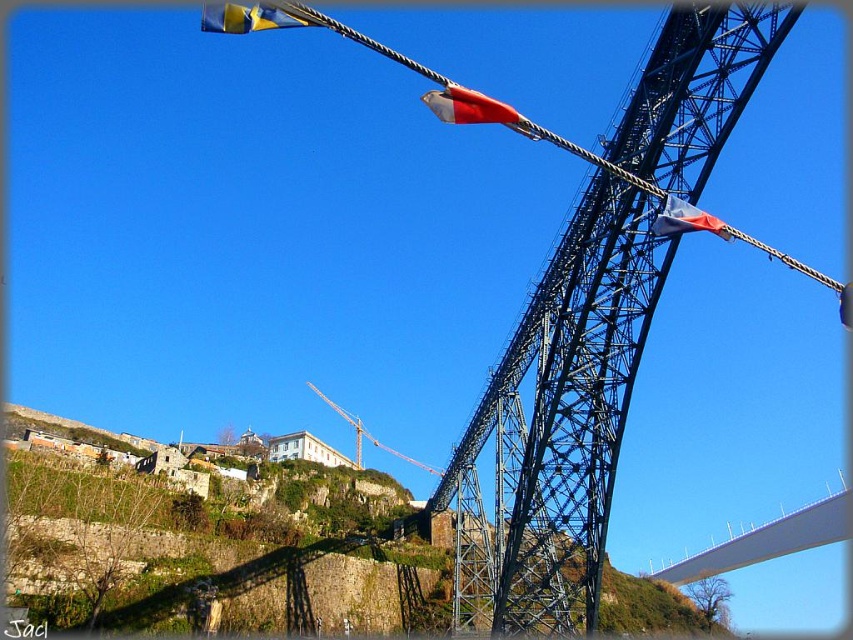
Question: Which object is closer to the camera taking this photo?

Choices:
 (A) yellow fabric flag at upper left
 (B) blue fabric flag at upper right
 (C) yellow metallic crane at center
 (D) white smooth bridge at center

Answer: (A)

Question: Is the position of yellow fabric flag at upper left more distant than that of blue fabric flag at upper right?

Choices:
 (A) yes
 (B) no

Answer: (B)

Question: Which point appears closest to the camera in this image?

Choices:
 (A) (741, 545)
 (B) (312, 26)
 (C) (488, 429)
 (D) (677, 198)

Answer: (D)

Question: Is white smooth bridge at center positioned before blue fabric flag at upper right?

Choices:
 (A) no
 (B) yes

Answer: (A)

Question: Which object is closer to the camera taking this photo?

Choices:
 (A) yellow metallic crane at center
 (B) red fabric flag at upper center
 (C) blue fabric flag at upper right

Answer: (B)

Question: Is metallic structure at center-right below yellow fabric flag at upper left?

Choices:
 (A) no
 (B) yes

Answer: (B)